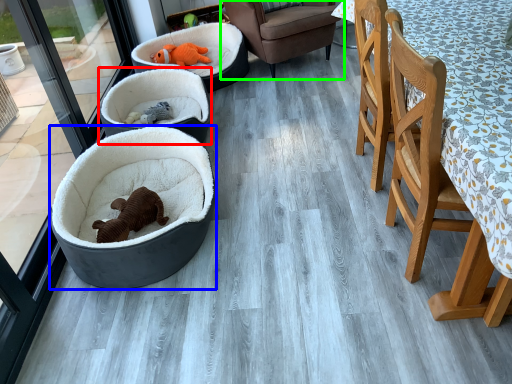
Question: Which object is positioned farthest from dog bed (highlighted by a red box)? Select from dog bed (highlighted by a blue box) and chair (highlighted by a green box).

Choices:
 (A) dog bed
 (B) chair

Answer: (B)